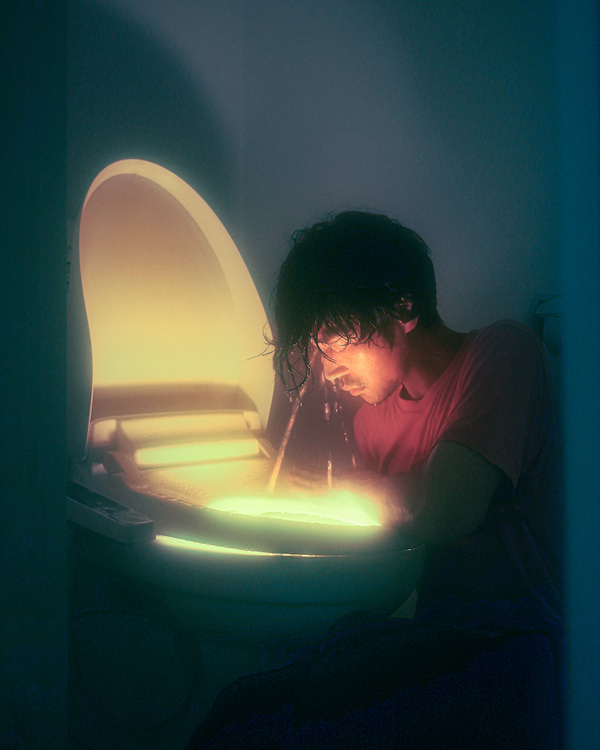
I want to click on bidet functions, so click(x=99, y=507).